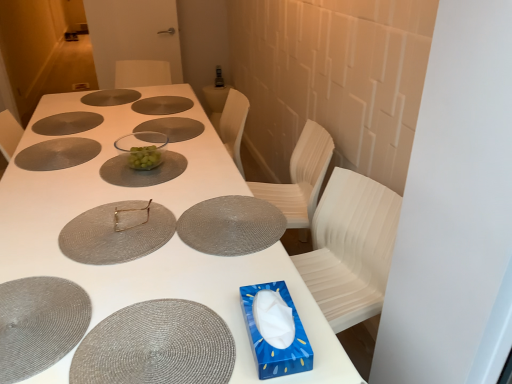
Where is `vacant area on top of matte gray placemat at center, placed as the seventh glass plate when sorted from back to front (from a real-world perspective)`? vacant area on top of matte gray placemat at center, placed as the seventh glass plate when sorted from back to front (from a real-world perspective) is located at coordinates (229, 220).